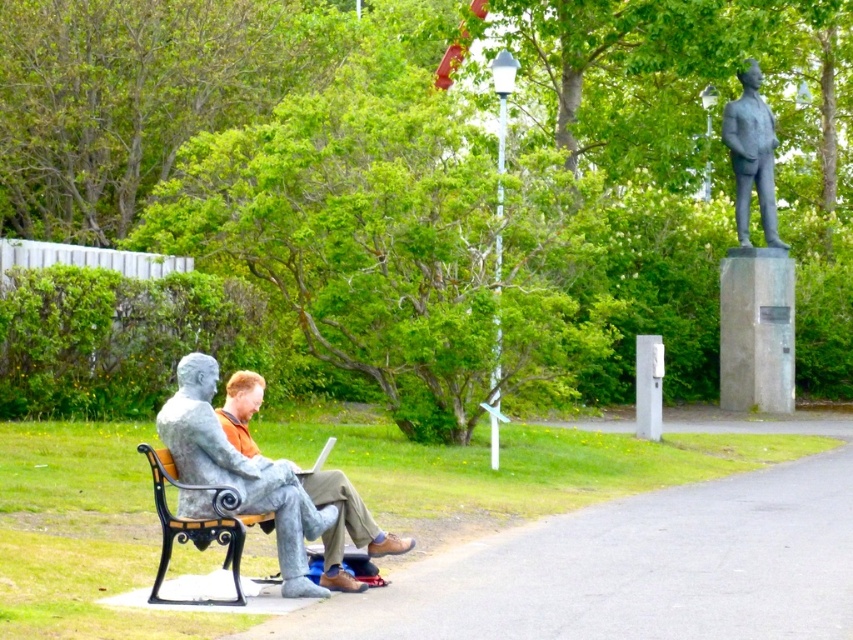
Question: Is gray stone statue at center closer to the viewer compared to black wrought iron bench at left?

Choices:
 (A) yes
 (B) no

Answer: (B)

Question: Can you confirm if smooth stone bench at lower left is smaller than black wrought iron bench at left?

Choices:
 (A) yes
 (B) no

Answer: (B)

Question: Estimate the real-world distances between objects in this image. Which object is closer to the black wrought iron bench at left?

Choices:
 (A) polished bronze statue at upper right
 (B) gray stone statue at center

Answer: (B)

Question: Is gray stone statue at center positioned behind polished bronze statue at upper right?

Choices:
 (A) no
 (B) yes

Answer: (A)

Question: Which point is closer to the camera taking this photo?

Choices:
 (A) (166, 467)
 (B) (367, 541)

Answer: (A)

Question: Which of the following is the closest to the observer?

Choices:
 (A) gray stone statue at center
 (B) black wrought iron bench at left
 (C) polished bronze statue at upper right

Answer: (B)